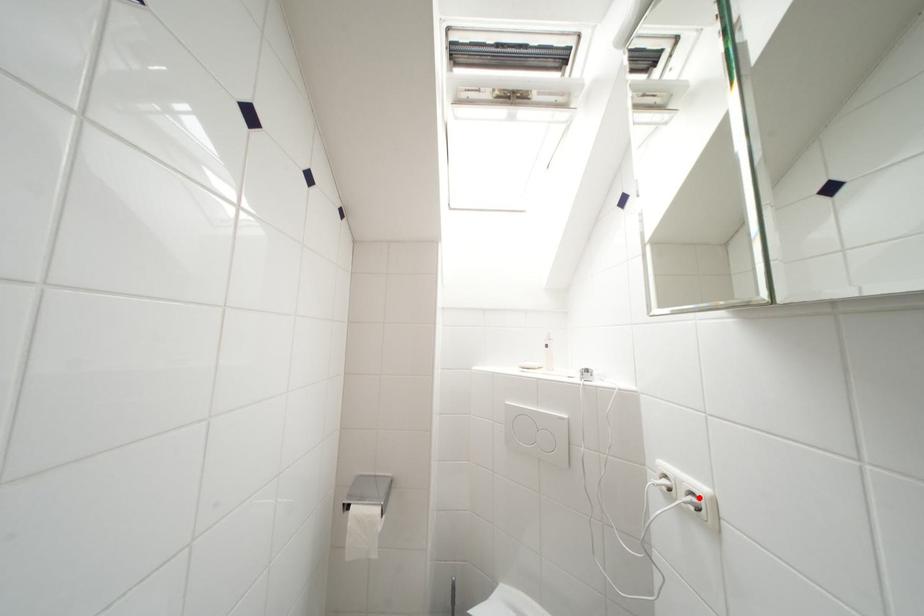
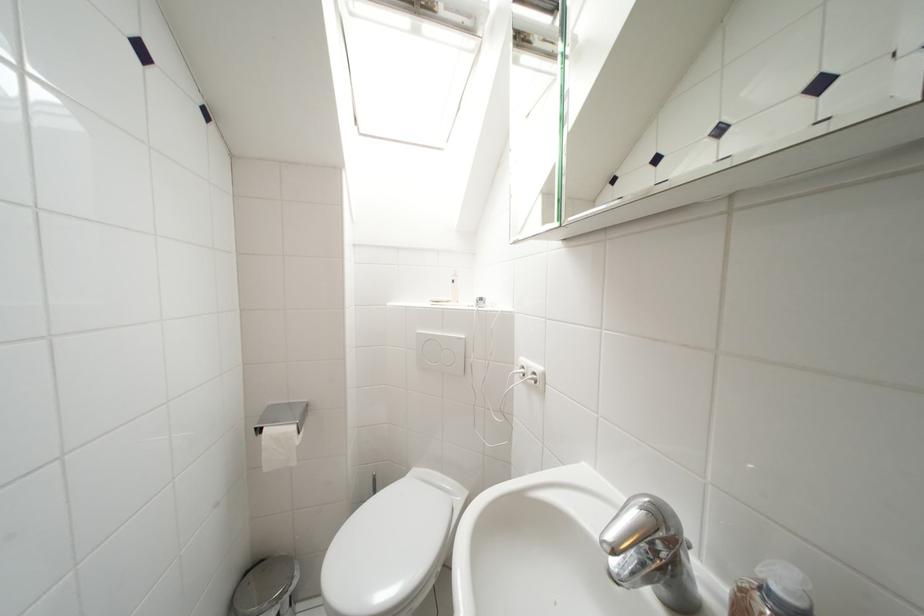
In the second image, find the point that corresponds to the highlighted location in the first image.

(541, 377)